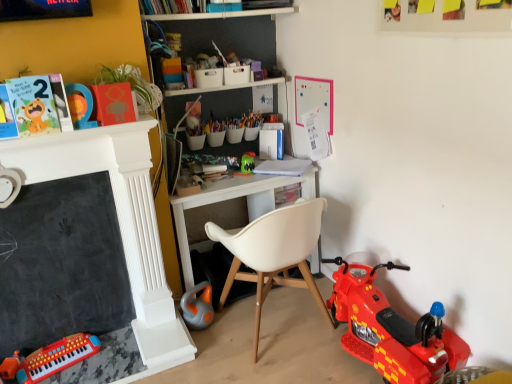
The image size is (512, 384). What are the coordinates of `free area in between orange plastic toy at lower center, which ranks as the fourth toy in left-to-right order, and white matte chair at center` in the screenshot? It's located at (223, 339).